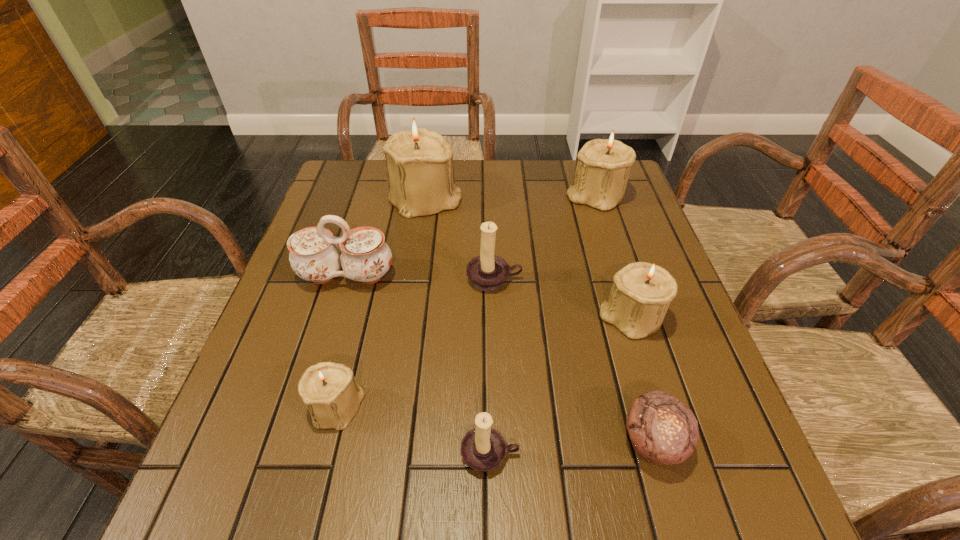
This screenshot has width=960, height=540. In the image, there is a desktop. Identify the location of vacant region at the near edge. (628, 488).

In the image, there is a desktop. At what (x,y) coordinates should I click in order to perform the action: click on vacant space at the left edge. Please return your answer as a coordinate pair (x, y). The width and height of the screenshot is (960, 540). Looking at the image, I should click on (276, 411).

The height and width of the screenshot is (540, 960). In order to click on vacant space at the far left corner in this screenshot , I will do `click(323, 200)`.

The image size is (960, 540). Identify the location of free spot at the near left corner of the desktop. (296, 485).

Image resolution: width=960 pixels, height=540 pixels. I want to click on free region at the near right corner, so click(684, 494).

The height and width of the screenshot is (540, 960). What are the coordinates of `empty space between the second tallest candle holder and the white chinaware` in the screenshot? It's located at (470, 235).

You are a GUI agent. You are given a task and a screenshot of the screen. Output one action in this format:
    pyautogui.click(x=<x>, y=<y>)
    Task: Click on the empty space that is in between the third farthest candle holder and the chinaware
    
    Given the screenshot: What is the action you would take?
    pyautogui.click(x=420, y=278)

The image size is (960, 540). What are the coordinates of `blank region between the bigger brown candle holder and the biggest beige candle_holder` in the screenshot? It's located at (460, 239).

Identify the location of empty location between the tallest candle holder and the fifth shortest candle holder. This screenshot has height=540, width=960. click(x=511, y=197).

Where is `free spot between the smaller brown candle holder and the tallest object`? The image size is (960, 540). free spot between the smaller brown candle holder and the tallest object is located at coordinates (458, 327).